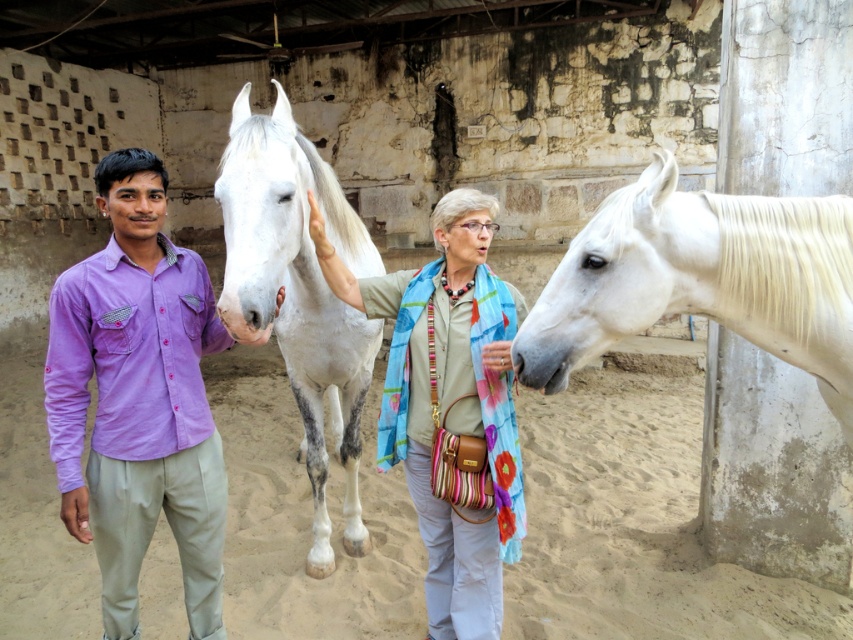
Does white glossy horse at right appear under light beige scarf at center?

Actually, white glossy horse at right is above light beige scarf at center.

Between point (828, 378) and point (427, 412), which one is positioned behind?

Point (427, 412)

Does point (694, 276) come in front of point (418, 376)?

That is True.

Image resolution: width=853 pixels, height=640 pixels. In order to click on white glossy horse at right in this screenshot , I will do `click(701, 280)`.

Between purple cotton shirt at left and light beige scarf at center, which one is positioned higher?

purple cotton shirt at left

Looking at this image, which of these two, purple cotton shirt at left or light beige scarf at center, stands taller?

light beige scarf at center

Does point (65, 464) come behind point (428, 285)?

No, (65, 464) is closer to viewer.

This screenshot has height=640, width=853. What are the coordinates of `purple cotton shirt at left` in the screenshot? It's located at (138, 400).

Which of these two, light beige scarf at center or white speckled fur at center, stands taller?

With more height is white speckled fur at center.

Between light beige scarf at center and white speckled fur at center, which one has less height?

light beige scarf at center

Is point (509, 298) positioned behind point (318, 436)?

No, it is in front of (318, 436).

At what (x,y) coordinates should I click in order to perform the action: click on light beige scarf at center. Please return your answer as a coordinate pair (x, y). The width and height of the screenshot is (853, 640). Looking at the image, I should click on (448, 401).